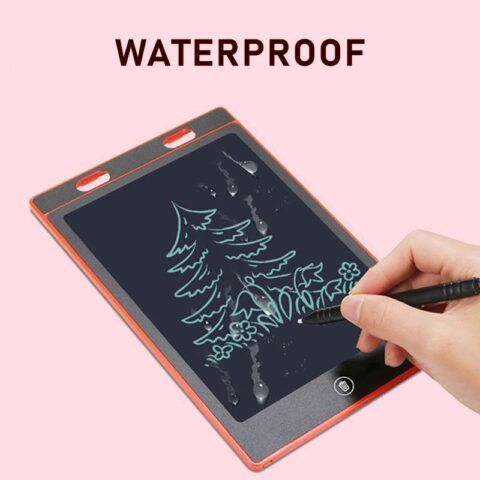
The height and width of the screenshot is (480, 480). Identify the location of black tablet pen. click(420, 299).